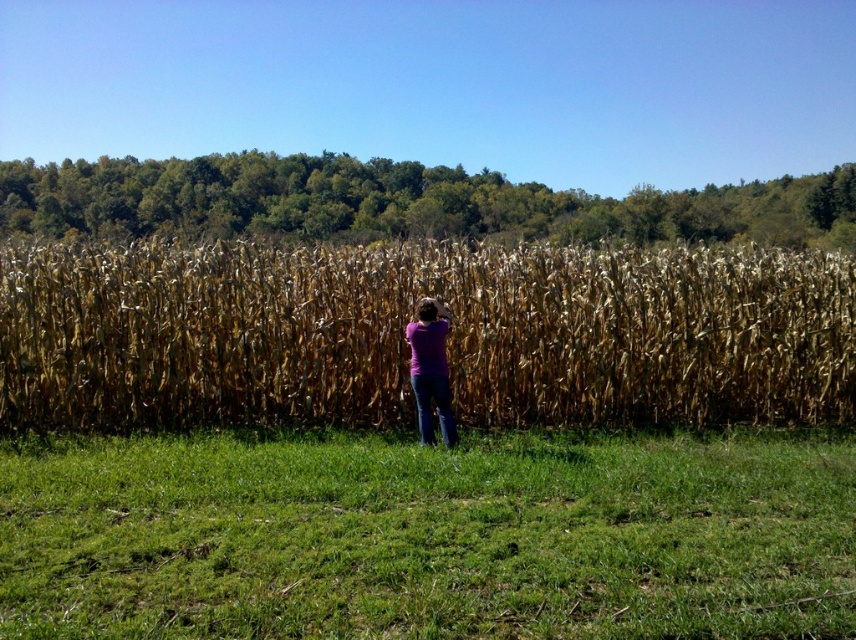
You are standing at the camera position and see two points in the scene. Which point, point (206, 456) or point (423, 435), is closer to you?

Point (206, 456) is closer to the camera than point (423, 435).

You are a gardener who needs to walk from the green grass at lower center to the purple matte shirt at center. Can you walk directly between them without stepping on the corn stalks?

The green grass at lower center is smaller than the purple matte shirt at center, but there is no information about the distance between them or the presence of obstacles like corn stalks in the path. Therefore, it is uncertain if you can walk directly between them without stepping on the corn stalks.

You are a photographer trying to capture a clear shot of the purple matte shirt at center. However, the dry stalks of corn at center are blocking your view. Can you move closer to the shirt to get a better shot without the corn stalks in the way?

The dry stalks of corn at center are further to the viewer than the purple matte shirt at center, meaning the shirt is actually behind the corn stalks. Since the corn stalks are closer to you, moving closer won